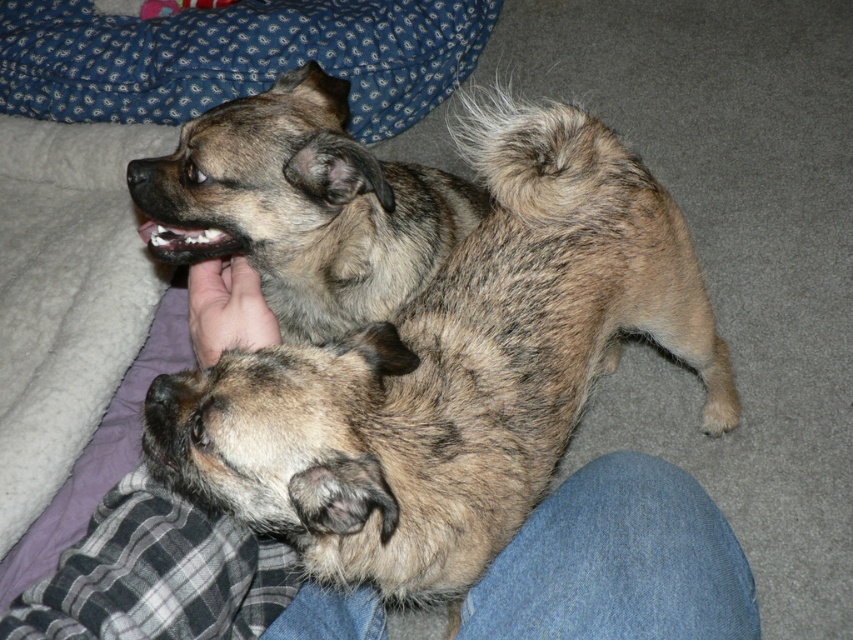
You are trying to pet the brown speckled fur dog at center but there is a soft skin hand at center in the way. Can you reach the dog without moving the hand?

The brown speckled fur dog at center is in front of the soft skin hand at center, so you can reach the dog without moving the hand because the dog is closer to you than the hand.

You are trying to pet the brown speckled fur dog at center and the soft skin hand at center. Which one is on the right side?

The brown speckled fur dog at center is positioned on the right side of the soft skin hand at center.

You are a photographer standing in the room. You want to take a closeup photo of the brown speckled fur dog at center. Your camera has a minimum focusing distance of 30 inches. Will you be able to take the photo without moving closer?

The brown speckled fur dog at center is 29.40 inches away from the camera, which is less than the minimum focusing distance of 30 inches. Therefore, you cannot take the closeup photo without moving further back.